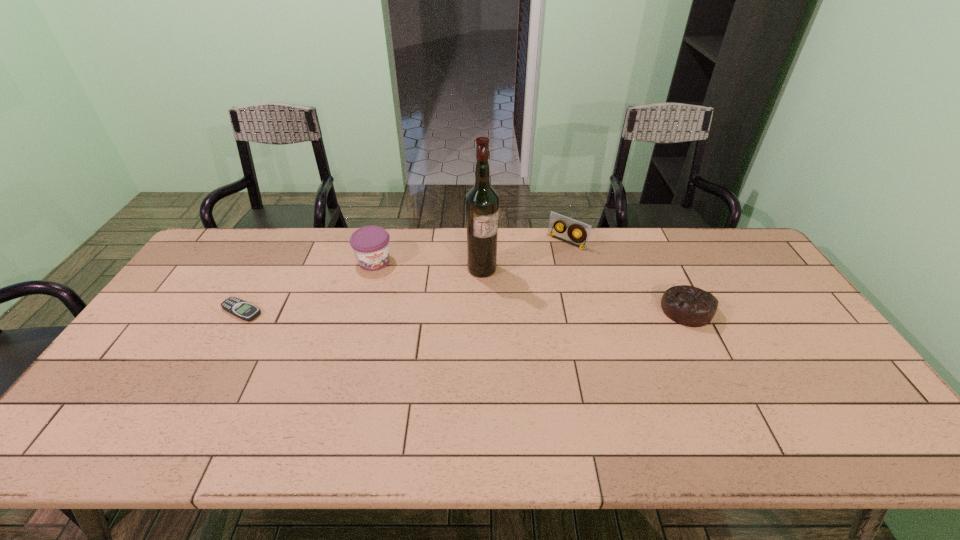
I want to click on free space on the desktop that is between the leftmost object and the beanbag and is positioned on the front and back of the wine bottle, so click(x=529, y=310).

The height and width of the screenshot is (540, 960). Identify the location of vacant space on the desktop that is between the beeper and the beanbag and is positioned at the front of the fourth object from left to right with visible reels. (499, 310).

Where is `free space on the desktop that is between the shortest object and the rightmost object and is positioned on the front label of the jam`? This screenshot has width=960, height=540. free space on the desktop that is between the shortest object and the rightmost object and is positioned on the front label of the jam is located at coordinates (399, 310).